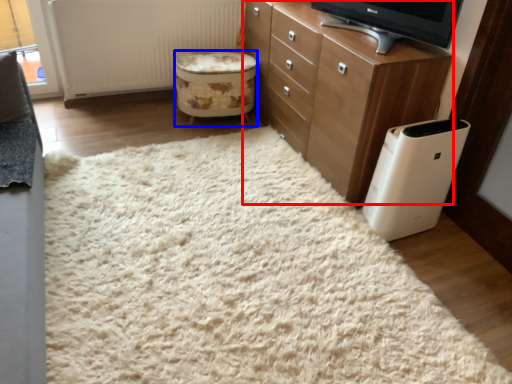
Question: Which object is further to the camera taking this photo, chest of drawers (highlighted by a red box) or stool (highlighted by a blue box)?

Choices:
 (A) chest of drawers
 (B) stool

Answer: (B)